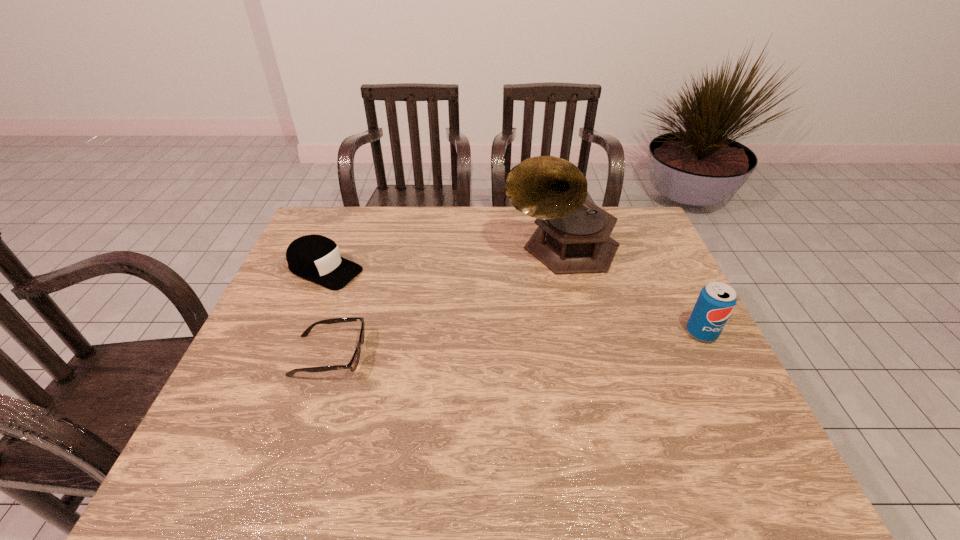
Image resolution: width=960 pixels, height=540 pixels. I want to click on free point between the shortest object and the rightmost object, so click(x=516, y=344).

The width and height of the screenshot is (960, 540). What are the coordinates of `empty location between the cap and the second object from right to left` in the screenshot? It's located at (443, 259).

Where is `vacant space that is in between the soda can and the phonograph record`? vacant space that is in between the soda can and the phonograph record is located at coordinates (632, 290).

Where is `free area in between the shortest object and the second object from right to left`? The height and width of the screenshot is (540, 960). free area in between the shortest object and the second object from right to left is located at coordinates (445, 301).

I want to click on blank region between the rightmost object and the second shortest object, so click(x=513, y=301).

Find the location of a particular element. The image size is (960, 540). object that ranks as the third closest to the third object from left to right is located at coordinates (316, 258).

Where is `the third closest object to the soda can`? The width and height of the screenshot is (960, 540). the third closest object to the soda can is located at coordinates (316, 258).

Image resolution: width=960 pixels, height=540 pixels. I want to click on vacant space that satisfies the following two spatial constraints: 1. on the back side of the cap; 2. on the right side of the tallest object, so click(x=334, y=247).

I want to click on vacant space that satisfies the following two spatial constraints: 1. on the front side of the second tallest object; 2. on the left side of the phonograph record, so click(x=581, y=333).

Where is `vacant space that satisfies the following two spatial constraints: 1. on the front side of the second tallest object; 2. on the left side of the phonograph record`? This screenshot has width=960, height=540. vacant space that satisfies the following two spatial constraints: 1. on the front side of the second tallest object; 2. on the left side of the phonograph record is located at coordinates (581, 333).